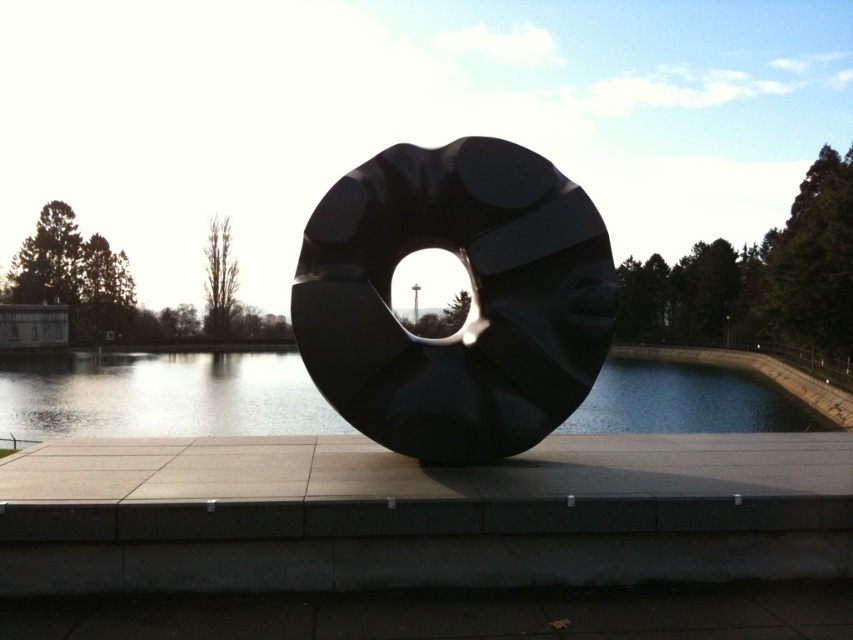
Consider the image. Is glossy black donut at center below transparent glass water at center?

Incorrect, glossy black donut at center is not positioned below transparent glass water at center.

Who is more distant from viewer, (376,316) or (662,394)?

The point (662,394) is more distant.

The image size is (853, 640). I want to click on glossy black donut at center, so click(x=473, y=298).

You are a GUI agent. You are given a task and a screenshot of the screen. Output one action in this format:
    pyautogui.click(x=<x>, y=<y>)
    Task: Click on the glossy black donut at center
    Image resolution: width=853 pixels, height=640 pixels.
    Given the screenshot: What is the action you would take?
    pyautogui.click(x=473, y=298)